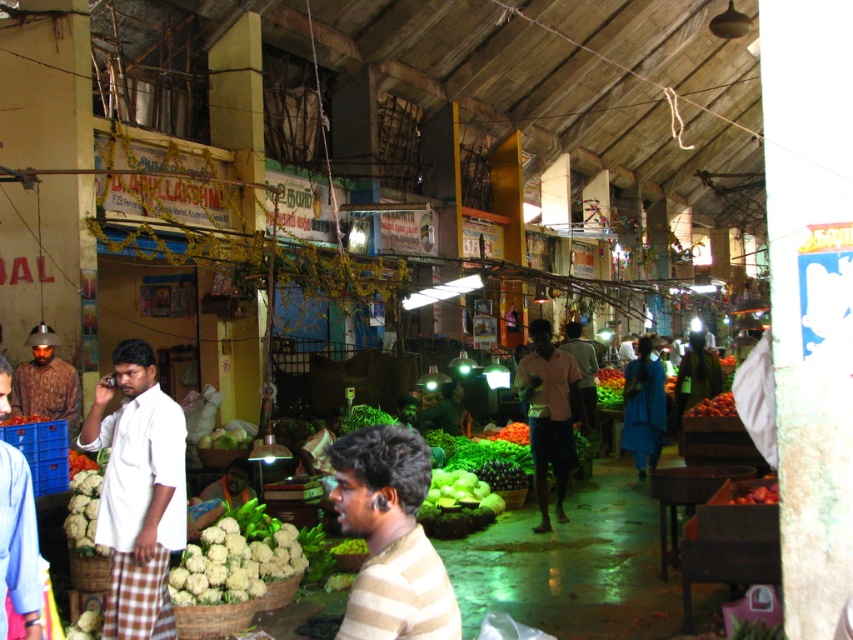
You are standing at the entrance of the market and want to take a photo that includes both the point at coordinates [242,556] and the point at [33,352]. Which point should you focus on to ensure both are in focus?

You should focus on the point that is closer to the camera, which is point [242,556], to ensure both points are in focus since the other point is further away.

You are a customer in the market and want to pick up the white cauliflower at lower center. However, there is a green fabric shirt at center in the way. Can you reach the cauliflower without moving the shirt?

The white cauliflower at lower center is in front of the green fabric shirt at center, so you can reach it without moving the shirt.

You are a customer in the market and want to pick up the white cauliflower at lower center. However, there is a green fabric shirt at center in your way. Can you reach the cauliflower without moving the shirt?

The white cauliflower at lower center is below the green fabric shirt at center, so you can reach it without moving the shirt by going around or underneath.